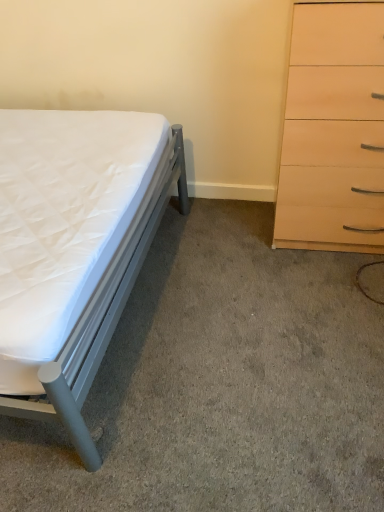
Question: In terms of width, does white quilted mattress at left look wider or thinner when compared to white quilted mattress at lower left?

Choices:
 (A) thin
 (B) wide

Answer: (A)

Question: Choose the correct answer: Is white quilted mattress at left inside white quilted mattress at lower left or outside it?

Choices:
 (A) outside
 (B) inside

Answer: (A)

Question: Which object is positioned farthest from the white quilted mattress at lower left?

Choices:
 (A) white quilted mattress at left
 (B) light wood/finish chest of drawers at right

Answer: (B)

Question: Estimate the real-world distances between objects in this image. Which object is farther from the white quilted mattress at lower left?

Choices:
 (A) white quilted mattress at left
 (B) light wood/finish chest of drawers at right

Answer: (B)